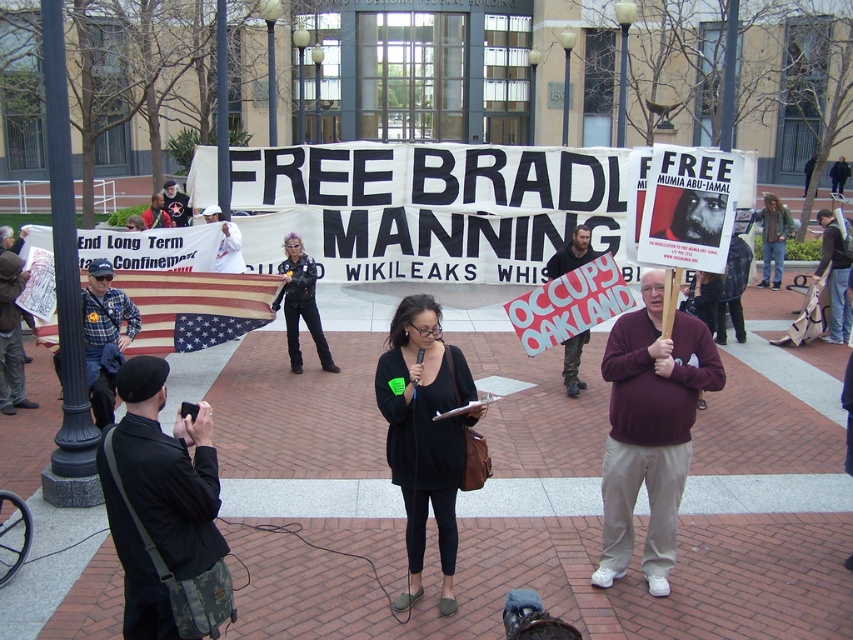
Question: Is black matte dress at center thinner than black leather pants at center?

Choices:
 (A) yes
 (B) no

Answer: (A)

Question: Which point is farther to the camera?

Choices:
 (A) black matte dress at center
 (B) black leather pants at center

Answer: (B)

Question: Which point is farther to the camera?

Choices:
 (A) (437, 305)
 (B) (314, 307)

Answer: (B)

Question: Where is black matte dress at center located in relation to black leather pants at center in the image?

Choices:
 (A) left
 (B) right

Answer: (B)

Question: Is black matte dress at center below black leather pants at center?

Choices:
 (A) yes
 (B) no

Answer: (A)